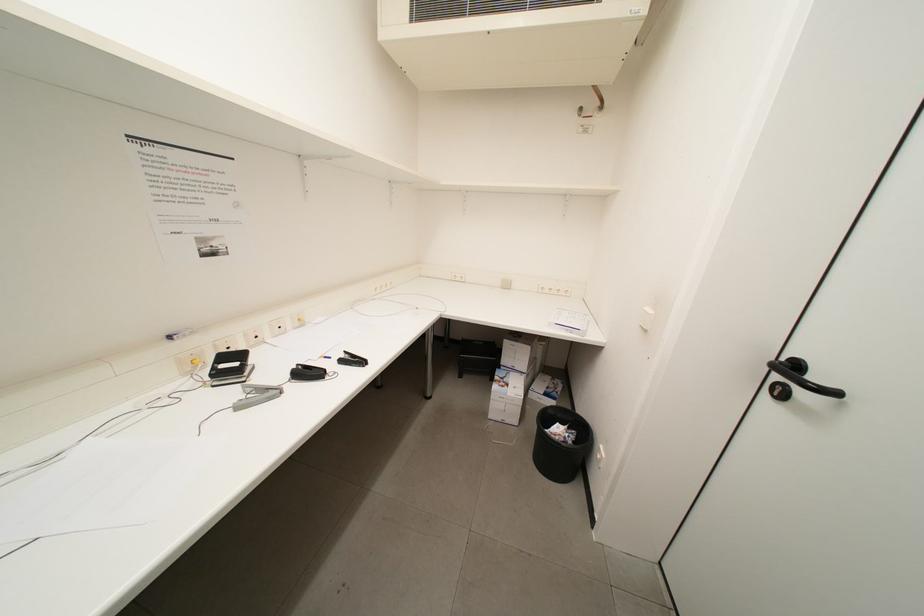
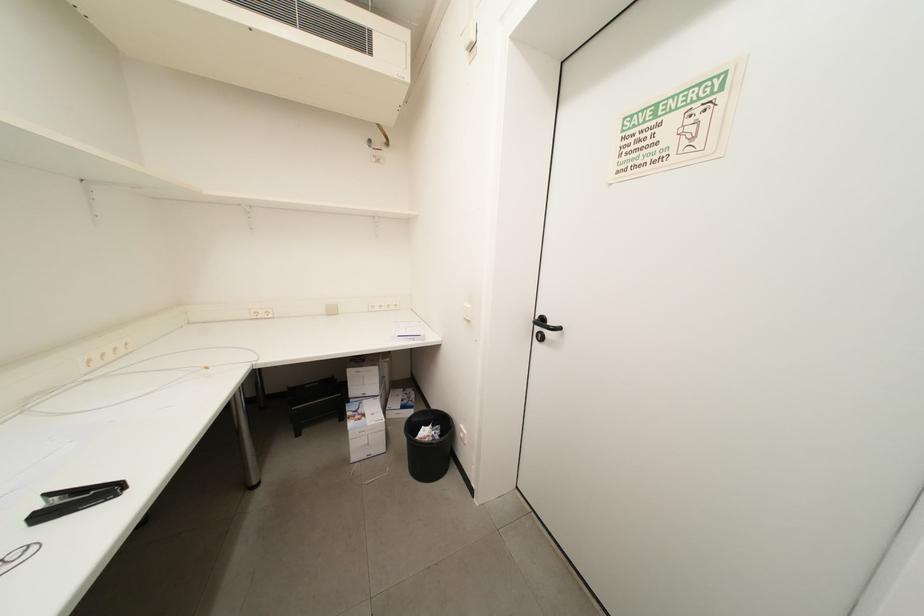
Question: The camera is either moving clockwise (left) or counter-clockwise (right) around the object. The first image is from the beginning of the video and the second image is from the end. Is the camera moving left or right when shooting the video?

Choices:
 (A) Left
 (B) Right

Answer: (A)